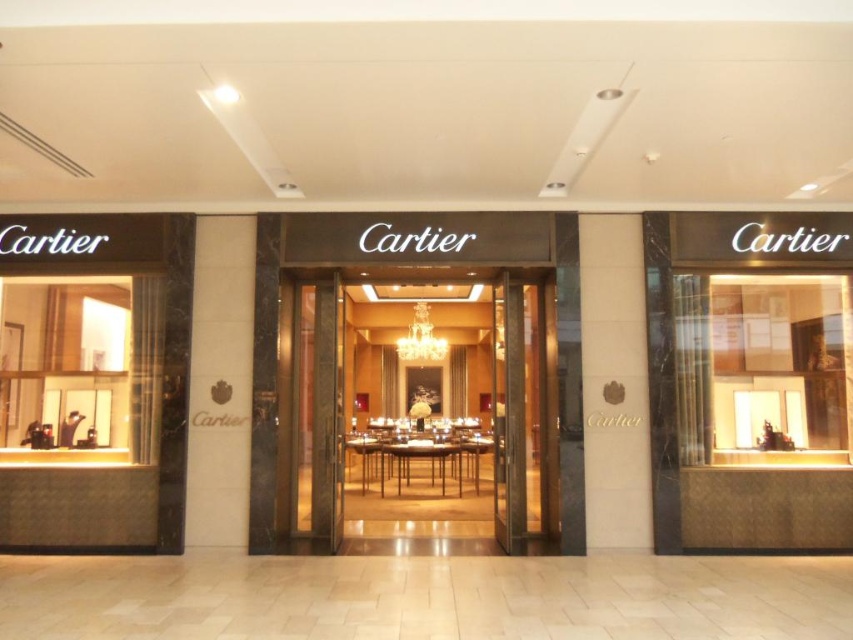
Question: Considering the relative positions of gold polished wood entrance at center and transparent glass door at center in the image provided, where is gold polished wood entrance at center located with respect to transparent glass door at center?

Choices:
 (A) right
 (B) left

Answer: (B)

Question: Is gold polished wood entrance at center thinner than transparent glass door at center?

Choices:
 (A) yes
 (B) no

Answer: (B)

Question: Can you confirm if gold polished wood entrance at center is positioned above transparent glass door at center?

Choices:
 (A) yes
 (B) no

Answer: (B)

Question: Among these points, which one is farthest from the camera?

Choices:
 (A) (506, 384)
 (B) (338, 332)

Answer: (B)

Question: Which point is farther to the camera?

Choices:
 (A) gold polished wood entrance at center
 (B) transparent glass door at center

Answer: (A)